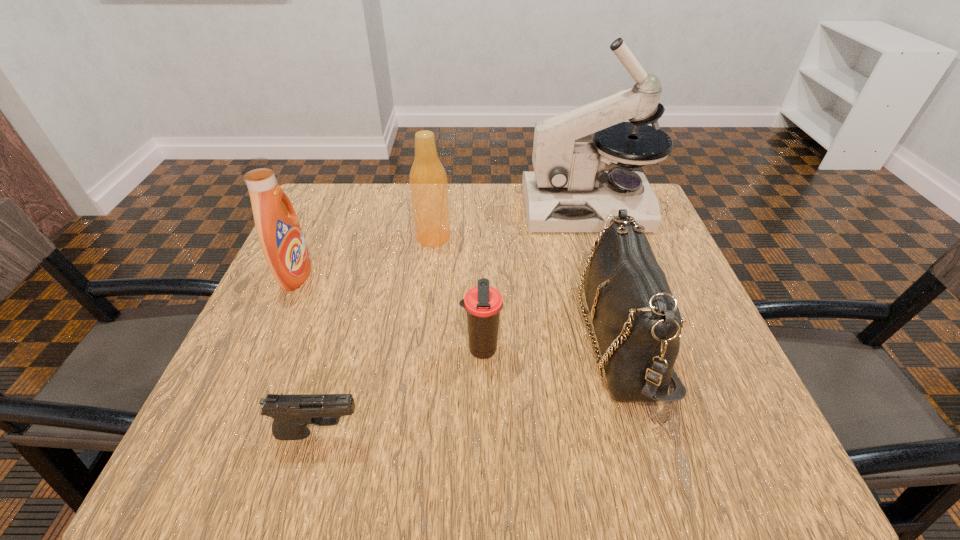
This screenshot has height=540, width=960. In the image, there is a desktop. In order to click on vacant space at the left edge in this screenshot , I will do `click(336, 246)`.

This screenshot has height=540, width=960. What are the coordinates of `vacant space at the far left corner` in the screenshot? It's located at (317, 194).

The height and width of the screenshot is (540, 960). I want to click on vacant space at the near right corner, so click(x=696, y=421).

In order to click on free spot between the microscope and the shortest object in this screenshot , I will do `click(454, 320)`.

You are a GUI agent. You are given a task and a screenshot of the screen. Output one action in this format:
    pyautogui.click(x=<x>, y=<y>)
    Task: Click on the free space that is in between the thermos bottle and the third shortest object
    
    Given the screenshot: What is the action you would take?
    pyautogui.click(x=551, y=345)

Where is `free space between the handbag and the pistol`? The height and width of the screenshot is (540, 960). free space between the handbag and the pistol is located at coordinates (470, 386).

The image size is (960, 540). In order to click on vacant space in between the second object from left to right and the microscope in this screenshot , I will do `click(454, 320)`.

Where is `empty location between the thermos bottle and the handbag`? empty location between the thermos bottle and the handbag is located at coordinates (551, 345).

The height and width of the screenshot is (540, 960). In order to click on unoccupied area between the beer bottle and the microscope in this screenshot , I will do `click(511, 222)`.

The height and width of the screenshot is (540, 960). What are the coordinates of `free spot between the beer bottle and the thermos bottle` in the screenshot? It's located at (457, 294).